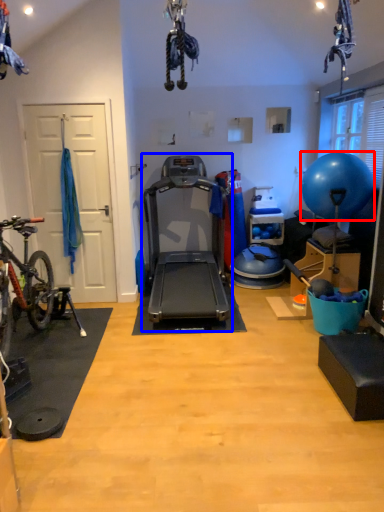
Question: Among these objects, which one is farthest to the camera, ball (highlighted by a red box) or treadmill (highlighted by a blue box)?

Choices:
 (A) ball
 (B) treadmill

Answer: (A)